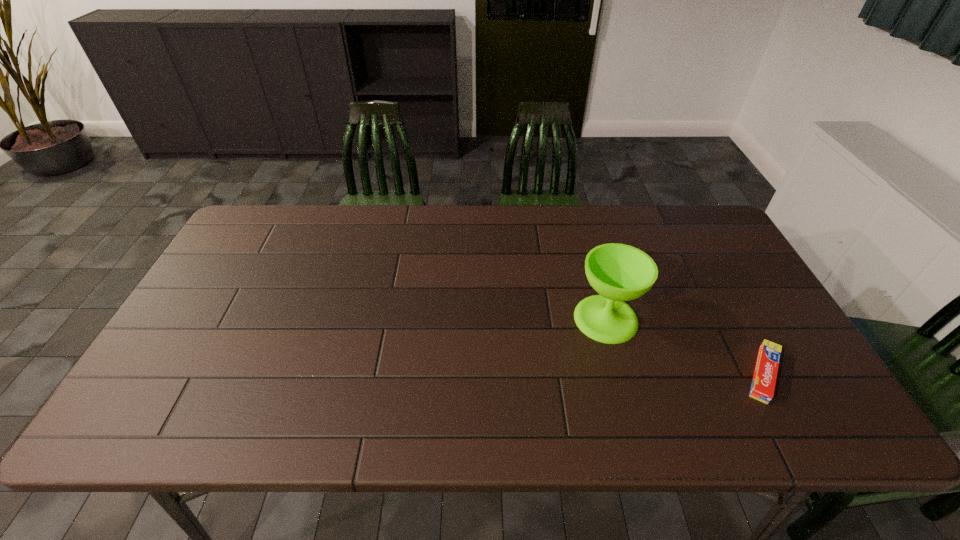
The image size is (960, 540). I want to click on the farther object, so click(618, 272).

Find the location of `the left object`. the left object is located at coordinates 618,272.

Locate an element on the screen. toothpaste is located at coordinates (763, 384).

The width and height of the screenshot is (960, 540). What are the coordinates of `the shorter object` in the screenshot? It's located at (763, 384).

The image size is (960, 540). I want to click on free space located on the left of the wineglass, so click(514, 319).

This screenshot has width=960, height=540. I want to click on free location located 0.070m on the left of the right object, so click(708, 374).

The width and height of the screenshot is (960, 540). Find the location of `object located at the near edge`. object located at the near edge is located at coordinates (763, 384).

Find the location of a particular element. object situated at the right edge is located at coordinates (763, 384).

Find the location of a particular element. The height and width of the screenshot is (540, 960). object at the near right corner is located at coordinates (763, 384).

Where is `vacant point at the far edge`? vacant point at the far edge is located at coordinates (487, 207).